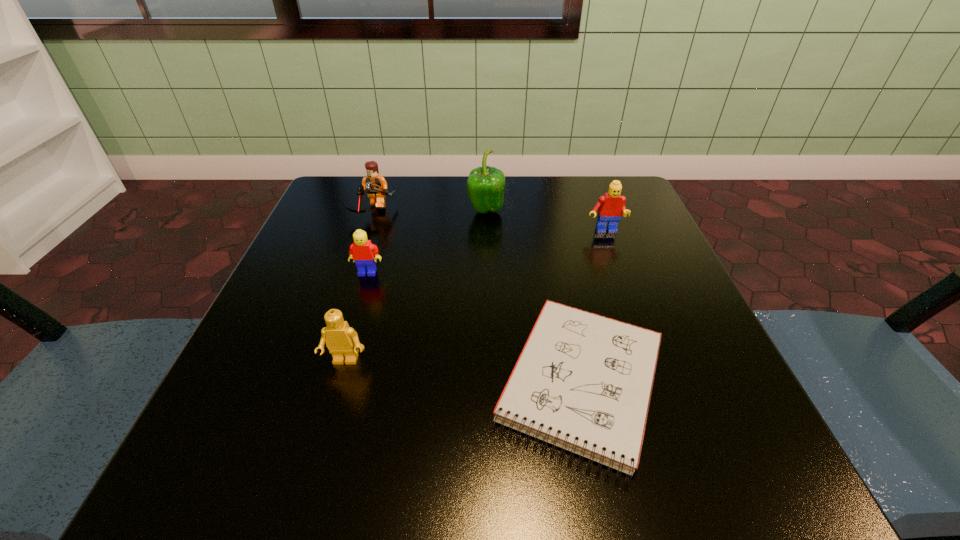
Find the location of `vacant space at the far edge of the desktop`. vacant space at the far edge of the desktop is located at coordinates (468, 197).

In the image, there is a desktop. Where is `free region at the near edge`? free region at the near edge is located at coordinates (423, 444).

In the image, there is a desktop. Identify the location of vacant space at the left edge. (303, 278).

The image size is (960, 540). In the image, there is a desktop. Find the location of `free space at the far left corner`. free space at the far left corner is located at coordinates (365, 208).

Where is `vacant space at the near left corner of the desktop`? Image resolution: width=960 pixels, height=540 pixels. vacant space at the near left corner of the desktop is located at coordinates 280,492.

This screenshot has height=540, width=960. I want to click on vacant position at the far right corner of the desktop, so click(x=622, y=191).

I want to click on blank space at the near right corner of the desktop, so click(x=749, y=483).

This screenshot has height=540, width=960. What are the coordinates of `free point between the third farthest Lego and the nearest Lego` in the screenshot? It's located at (356, 317).

Locate an element on the screen. This screenshot has width=960, height=540. free space between the nearest Lego and the tallest object is located at coordinates (416, 286).

Identify the location of free point between the shortest object and the nearest Lego. coord(464,372).